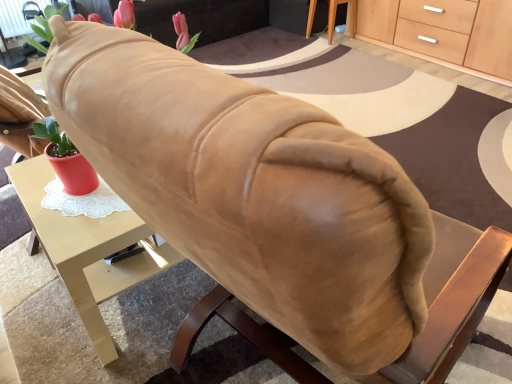
You are a GUI agent. You are given a task and a screenshot of the screen. Output one action in this format:
    pyautogui.click(x=<x>, y=<y>)
    Task: Click on the suede-like beige couch at upper center
    
    Given the screenshot: What is the action you would take?
    pyautogui.click(x=201, y=18)

This screenshot has width=512, height=384. I want to click on light wood/wooden cabinet at upper right, so click(x=444, y=32).

Where is `wooden table at lower right`? wooden table at lower right is located at coordinates (335, 17).

Identify the location of suede-like beige couch at upper center. (201, 18).

Is point (389, 45) positioned before point (330, 32)?

Yes, it is in front of point (330, 32).

Is wooden table at lower right inside light wood/wooden cabinet at upper right?

Definitely not — wooden table at lower right is not inside light wood/wooden cabinet at upper right.

From the image's perspective, is light wood/wooden cabinet at upper right located above or below wooden table at lower right?

light wood/wooden cabinet at upper right is situated lower than wooden table at lower right in the image.

Considering the sizes of objects light wood/wooden cabinet at upper right and wooden table at lower right in the image provided, who is taller, light wood/wooden cabinet at upper right or wooden table at lower right?

With more height is light wood/wooden cabinet at upper right.

In the scene shown: From the image's perspective, which is below, suede-like beige couch at upper center or wooden table at lower right?

From the image's view, wooden table at lower right is below.

In the scene shown: Between suede-like beige couch at upper center and wooden table at lower right, which one has smaller size?

wooden table at lower right is smaller.

How much distance is there between suede-like beige couch at upper center and wooden table at lower right?

suede-like beige couch at upper center and wooden table at lower right are 30.49 inches apart from each other.

Is suede-like beige couch at upper center facing away from wooden table at lower right?

That's not correct — suede-like beige couch at upper center is not looking away from wooden table at lower right.

From the image's perspective, who appears lower, matte gold desk at center or suede-like beige couch at upper center?

matte gold desk at center, from the image's perspective.

Is matte gold desk at center aimed at suede-like beige couch at upper center?

No, matte gold desk at center does not turn towards suede-like beige couch at upper center.

Is matte gold desk at center bigger or smaller than suede-like beige couch at upper center?

matte gold desk at center is smaller than suede-like beige couch at upper center.

Which of these two, matte gold desk at center or suede-like beige couch at upper center, is wider?

suede-like beige couch at upper center.

Considering the sizes of objects wooden table at lower right and light wood/wooden cabinet at upper right in the image provided, who is taller, wooden table at lower right or light wood/wooden cabinet at upper right?

With more height is light wood/wooden cabinet at upper right.

Does point (334, 29) come behind point (373, 41)?

Yes.

Does wooden table at lower right turn towards light wood/wooden cabinet at upper right?

No, wooden table at lower right is not aimed at light wood/wooden cabinet at upper right.

Which is closer, (169, 34) or (90, 328)?

Point (169, 34).

Based on the photo, is matte gold desk at center completely or partially inside suede-like beige couch at upper center?

No, matte gold desk at center is not surrounded by suede-like beige couch at upper center.

Based on the photo, can you confirm if suede-like beige couch at upper center is smaller than matte gold desk at center?

Incorrect, suede-like beige couch at upper center is not smaller in size than matte gold desk at center.

From the image's perspective, which one is positioned lower, suede-like beige couch at upper center or matte gold desk at center?

matte gold desk at center, from the image's perspective.

Is suede-like beige couch at upper center at the back of light wood/wooden cabinet at upper right?

light wood/wooden cabinet at upper right does not have its back to suede-like beige couch at upper center.

Which is more to the left, light wood/wooden cabinet at upper right or suede-like beige couch at upper center?

Positioned to the left is suede-like beige couch at upper center.

Which object is wider, light wood/wooden cabinet at upper right or suede-like beige couch at upper center?

With larger width is suede-like beige couch at upper center.

Which of these two, light wood/wooden cabinet at upper right or suede-like beige couch at upper center, is smaller?

light wood/wooden cabinet at upper right.

Looking at this image, which is nearer, (315, 5) or (166, 27)?

Point (166, 27)

Does wooden table at lower right appear on the left side of suede-like beige couch at upper center?

No, wooden table at lower right is not to the left of suede-like beige couch at upper center.

Is wooden table at lower right outside of suede-like beige couch at upper center?

Yes.

Considering the sizes of objects wooden table at lower right and suede-like beige couch at upper center in the image provided, who is bigger, wooden table at lower right or suede-like beige couch at upper center?

Bigger between the two is suede-like beige couch at upper center.

Find the location of `cabinetry lying in front of the wooden table at lower right`. cabinetry lying in front of the wooden table at lower right is located at coordinates (444, 32).

Identify the location of couch above the wooden table at lower right (from the image's perspective). This screenshot has height=384, width=512. (201, 18).

Looking at the image, which one is located further to suede-like beige couch at upper center, matte gold desk at center or wooden table at lower right?

Among the two, matte gold desk at center is located further to suede-like beige couch at upper center.

When comparing their distances from light wood/wooden cabinet at upper right, does wooden table at lower right or suede-like beige couch at upper center seem further?

suede-like beige couch at upper center.

Looking at the image, which one is located further to suede-like beige couch at upper center, light wood/wooden cabinet at upper right or wooden table at lower right?

light wood/wooden cabinet at upper right is further to suede-like beige couch at upper center.

Consider the image. Based on their spatial positions, is light wood/wooden cabinet at upper right or matte gold desk at center further from wooden table at lower right?

Among the two, matte gold desk at center is located further to wooden table at lower right.

Estimate the real-world distances between objects in this image. Which object is closer to suede-like beige couch at upper center, wooden table at lower right or light wood/wooden cabinet at upper right?

wooden table at lower right is closer to suede-like beige couch at upper center.

Estimate the real-world distances between objects in this image. Which object is further from light wood/wooden cabinet at upper right, wooden table at lower right or matte gold desk at center?

matte gold desk at center.

From the image, which object appears to be farther from light wood/wooden cabinet at upper right, suede-like beige couch at upper center or matte gold desk at center?

The object further to light wood/wooden cabinet at upper right is matte gold desk at center.

When comparing their distances from matte gold desk at center, does wooden table at lower right or light wood/wooden cabinet at upper right seem closer?

light wood/wooden cabinet at upper right lies closer to matte gold desk at center than the other object.

Image resolution: width=512 pixels, height=384 pixels. I want to click on couch between matte gold desk at center and wooden table at lower right in the front-back direction, so click(201, 18).

At what (x,y) coordinates should I click in order to perform the action: click on desk situated between suede-like beige couch at upper center and light wood/wooden cabinet at upper right from left to right. Please return your answer as a coordinate pair (x, y). Looking at the image, I should click on (88, 250).

This screenshot has width=512, height=384. I want to click on table located between suede-like beige couch at upper center and light wood/wooden cabinet at upper right in the left-right direction, so click(x=335, y=17).

Locate an element on the screen. Image resolution: width=512 pixels, height=384 pixels. cabinetry positioned between matte gold desk at center and wooden table at lower right from near to far is located at coordinates (444, 32).